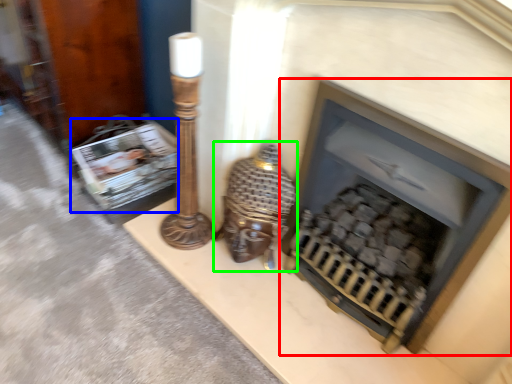
Question: Considering the real-world distances, which object is closest to fireplace (highlighted by a red box)? magazine (highlighted by a blue box) or table lamp (highlighted by a green box).

Choices:
 (A) magazine
 (B) table lamp

Answer: (B)